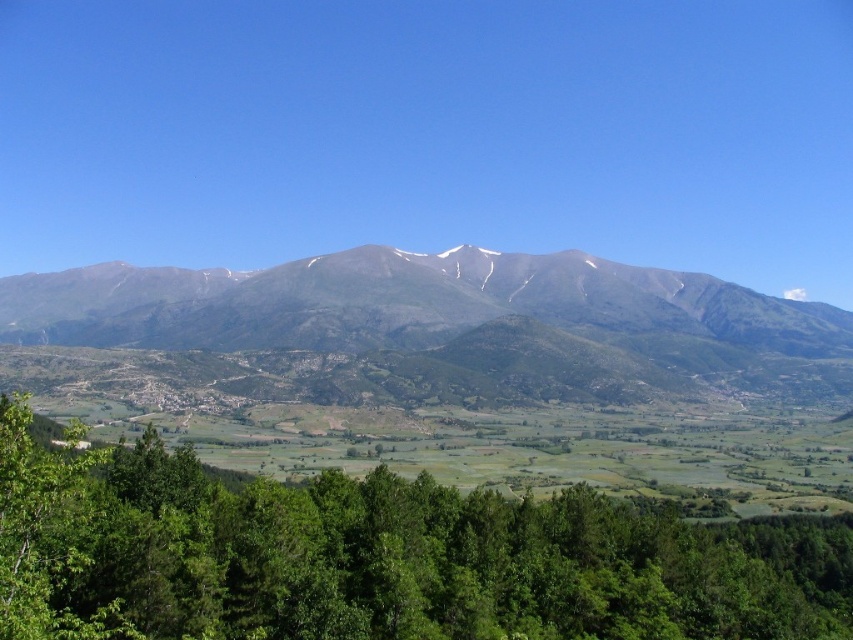
Question: Which point is farther to the camera?

Choices:
 (A) pyautogui.click(x=51, y=568)
 (B) pyautogui.click(x=491, y=308)

Answer: (B)

Question: Considering the relative positions of green leafy tree at lower center and gray rocky mountain range at center in the image provided, where is green leafy tree at lower center located with respect to gray rocky mountain range at center?

Choices:
 (A) right
 (B) left

Answer: (B)

Question: Which point is closer to the camera?

Choices:
 (A) (x=451, y=308)
 (B) (x=322, y=570)

Answer: (B)

Question: Does green leafy tree at lower center have a greater width compared to gray rocky mountain range at center?

Choices:
 (A) no
 (B) yes

Answer: (A)

Question: Is green leafy tree at lower center positioned at the back of gray rocky mountain range at center?

Choices:
 (A) yes
 (B) no

Answer: (B)